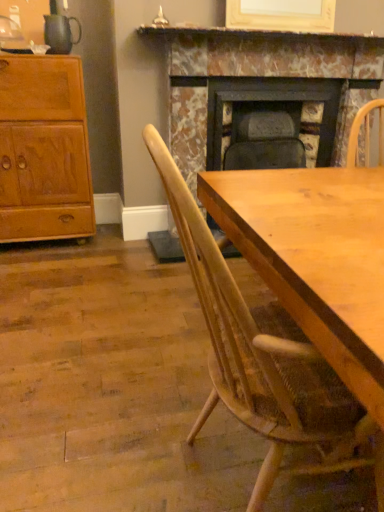
Describe the element at coordinates (263, 357) in the screenshot. I see `light wood chair at center` at that location.

The width and height of the screenshot is (384, 512). I want to click on marble fireplace at upper center, so click(257, 34).

Identify the location of light wood chair at center. (263, 357).

Is light brown wood cabinet at left aimed at marble fireplace at upper center?

No, light brown wood cabinet at left is not aimed at marble fireplace at upper center.

From the image's perspective, is light brown wood cabinet at left below marble fireplace at upper center?

Yes.

Considering the relative sizes of light brown wood cabinet at left and marble fireplace at upper center in the image provided, is light brown wood cabinet at left bigger than marble fireplace at upper center?

Yes.

I want to click on cabinetry below the marble fireplace at upper center (from the image's perspective), so click(44, 150).

Can you see marble fireplace at center touching light wood chair at center?

No, marble fireplace at center is not with light wood chair at center.

Is marble fireplace at center positioned with its back to light wood chair at center?

No, marble fireplace at center's orientation is not away from light wood chair at center.

Is marble fireplace at center taller than light wood chair at center?

Indeed, marble fireplace at center has a greater height compared to light wood chair at center.

Considering the sizes of marble fireplace at center and light wood chair at center in the image, is marble fireplace at center wider or thinner than light wood chair at center?

Clearly, marble fireplace at center has less width compared to light wood chair at center.

Is light brown wood cabinet at left inside or outside of light wood chair at center?

light brown wood cabinet at left is spatially situated outside light wood chair at center.

Is point (17, 122) closer or farther from the camera than point (285, 392)?

Point (17, 122).

Are light brown wood cabinet at left and light wood chair at center making contact?

No, light brown wood cabinet at left is not with light wood chair at center.

Can you confirm if light brown wood cabinet at left is positioned to the left of light wood chair at center?

Yes, light brown wood cabinet at left is to the left of light wood chair at center.

Is the position of marble fireplace at upper center more distant than that of light brown wood cabinet at left?

Yes, the depth of marble fireplace at upper center is greater than that of light brown wood cabinet at left.

From the image's perspective, which is below, marble fireplace at upper center or light brown wood cabinet at left?

light brown wood cabinet at left appears lower in the image.

From the image's perspective, is light wood chair at center positioned above or below marble fireplace at center?

light wood chair at center is situated lower than marble fireplace at center in the image.

Is light wood chair at center aimed at marble fireplace at center?

No, light wood chair at center is not oriented towards marble fireplace at center.

Considering the relative sizes of light wood chair at center and marble fireplace at center in the image provided, is light wood chair at center wider than marble fireplace at center?

Yes, light wood chair at center is wider than marble fireplace at center.

Does light wood chair at center have a smaller size compared to marble fireplace at center?

Correct, light wood chair at center occupies less space than marble fireplace at center.

Who is bigger, marble fireplace at center or marble fireplace at upper center?

Bigger between the two is marble fireplace at center.

Which of these two, marble fireplace at center or marble fireplace at upper center, stands shorter?

marble fireplace at upper center is shorter.

From a real-world perspective, does marble fireplace at center stand above marble fireplace at upper center?

Actually, marble fireplace at center is physically below marble fireplace at upper center in the real world.

From the image's perspective, is marble fireplace at center located above or below marble fireplace at upper center?

Clearly, from the image's perspective, marble fireplace at center is below marble fireplace at upper center.

How far apart are light wood chair at center and light brown wood cabinet at left?

They are 1.91 meters apart.

Which is closer, (342, 426) or (68, 216)?

Point (342, 426)

Find the location of a particular element. The image size is (384, 512). cabinetry on the left of light wood chair at center is located at coordinates (44, 150).

Is light wood chair at center in front of or behind light brown wood cabinet at left in the image?

light wood chair at center is positioned closer to the viewer than light brown wood cabinet at left.

At what (x,y) coordinates should I click in order to perform the action: click on cabinetry to the left of marble fireplace at upper center. Please return your answer as a coordinate pair (x, y). The height and width of the screenshot is (512, 384). Looking at the image, I should click on (44, 150).

Identify the location of fireplace above the light wood chair at center (from a real-world perspective). (264, 96).

From the picture: Which object lies nearer to the anchor point light wood chair at center, marble fireplace at center or marble fireplace at upper center?

marble fireplace at center lies closer to light wood chair at center than the other object.

Consider the image. Considering their positions, is light brown wood cabinet at left positioned further to marble fireplace at upper center than marble fireplace at center?

Based on the image, light brown wood cabinet at left appears to be further to marble fireplace at upper center.

Looking at the image, which one is located closer to marble fireplace at center, light wood chair at center or light brown wood cabinet at left?

Based on the image, light brown wood cabinet at left appears to be nearer to marble fireplace at center.

Which object lies nearer to the anchor point light brown wood cabinet at left, marble fireplace at upper center or marble fireplace at center?

marble fireplace at upper center lies closer to light brown wood cabinet at left than the other object.

Which object lies nearer to the anchor point marble fireplace at center, light wood chair at center or marble fireplace at upper center?

marble fireplace at upper center lies closer to marble fireplace at center than the other object.

Based on the photo, which object lies nearer to the anchor point light brown wood cabinet at left, light wood chair at center or marble fireplace at center?

marble fireplace at center.

Which object lies further to the anchor point marble fireplace at upper center, light wood chair at center or light brown wood cabinet at left?

Among the two, light wood chair at center is located further to marble fireplace at upper center.

Looking at the image, which one is located further to light brown wood cabinet at left, marble fireplace at center or light wood chair at center?

light wood chair at center is further to light brown wood cabinet at left.

Identify the location of cabinetry between light wood chair at center and marble fireplace at center along the z-axis. The width and height of the screenshot is (384, 512). 44,150.

Where is `cabinetry positioned between light wood chair at center and marble fireplace at upper center from near to far`? This screenshot has height=512, width=384. cabinetry positioned between light wood chair at center and marble fireplace at upper center from near to far is located at coordinates (44, 150).

You are a GUI agent. You are given a task and a screenshot of the screen. Output one action in this format:
    pyautogui.click(x=<x>, y=<y>)
    Task: Click on the mantle located between light brown wood cabinet at left and marble fireplace at center in the left-right direction
    This screenshot has height=512, width=384.
    Given the screenshot: What is the action you would take?
    pyautogui.click(x=257, y=34)

Where is `mantle located between light wood chair at center and marble fireplace at center in the depth direction`? This screenshot has width=384, height=512. mantle located between light wood chair at center and marble fireplace at center in the depth direction is located at coordinates (257, 34).